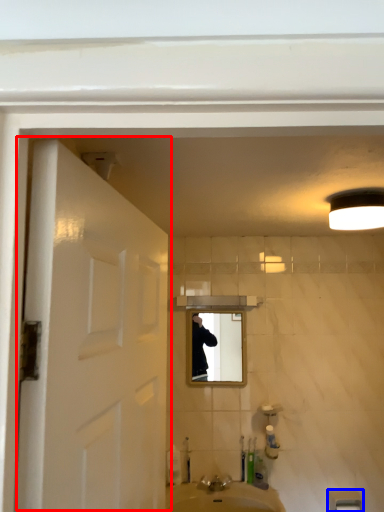
Question: Which object is closer to the camera taking this photo, door (highlighted by a red box) or towel bar (highlighted by a blue box)?

Choices:
 (A) door
 (B) towel bar

Answer: (A)